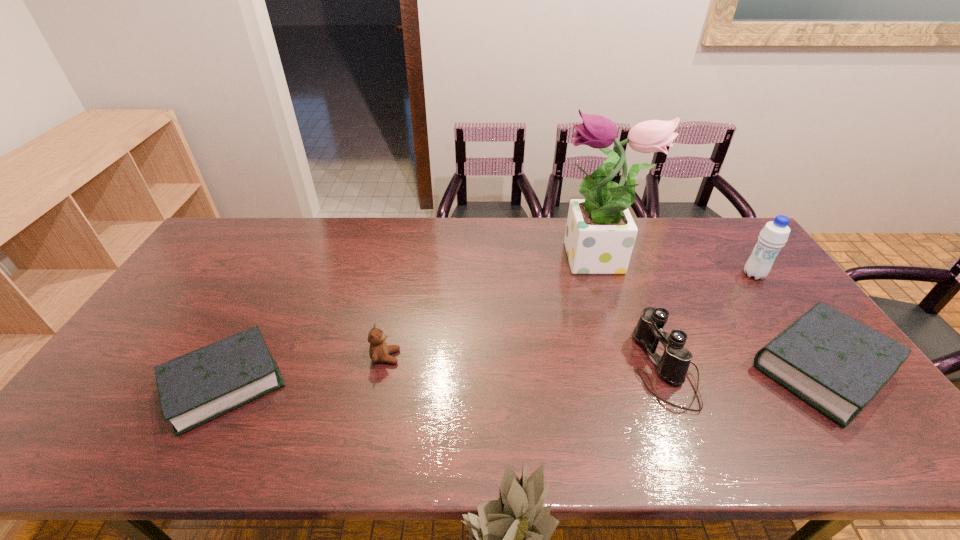
Locate an element on the screen. This screenshot has height=540, width=960. vacant space located on the left of the fifth tallest object is located at coordinates (729, 367).

Where is `blank area located 0.400m on the left of the water bottle`? blank area located 0.400m on the left of the water bottle is located at coordinates (620, 275).

Locate an element on the screen. free region located 0.240m on the front-facing side of the flower arrangement is located at coordinates (485, 261).

Image resolution: width=960 pixels, height=540 pixels. Identify the location of free space located 0.260m on the front-facing side of the flower arrangement. click(479, 261).

Where is `free location located on the front-facing side of the flower arrangement`? The width and height of the screenshot is (960, 540). free location located on the front-facing side of the flower arrangement is located at coordinates (520, 261).

This screenshot has height=540, width=960. Identify the location of vacant space situated at the face of the third shortest object. (496, 357).

Locate an element on the screen. vacant space located 0.220m on the back of the binoculars is located at coordinates (629, 279).

Locate an element on the screen. The height and width of the screenshot is (540, 960). object that is at the far edge is located at coordinates (600, 234).

Find the location of a particular element. binoculars present at the near edge is located at coordinates (673, 365).

At what (x,y) coordinates should I click in order to perform the action: click on object present at the left edge. Please return your answer as a coordinate pair (x, y). Looking at the image, I should click on (199, 386).